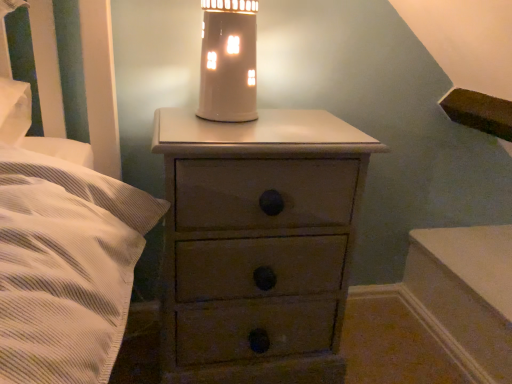
Question: Is matte brown chest of drawers at center placed right next to matte white oil lamp at upper center?

Choices:
 (A) yes
 (B) no

Answer: (B)

Question: From the image's perspective, does matte brown chest of drawers at center appear lower than matte white oil lamp at upper center?

Choices:
 (A) yes
 (B) no

Answer: (A)

Question: From the image's perspective, is matte brown chest of drawers at center over matte white oil lamp at upper center?

Choices:
 (A) yes
 (B) no

Answer: (B)

Question: Does matte brown chest of drawers at center have a greater height compared to matte white oil lamp at upper center?

Choices:
 (A) no
 (B) yes

Answer: (B)

Question: Is matte brown chest of drawers at center far from matte white oil lamp at upper center?

Choices:
 (A) no
 (B) yes

Answer: (A)

Question: Is the depth of matte brown chest of drawers at center less than that of matte white oil lamp at upper center?

Choices:
 (A) no
 (B) yes

Answer: (B)

Question: Can you confirm if matte white oil lamp at upper center is smaller than matte brown chest of drawers at center?

Choices:
 (A) no
 (B) yes

Answer: (B)

Question: Can you confirm if matte white oil lamp at upper center is positioned to the left of matte brown chest of drawers at center?

Choices:
 (A) yes
 (B) no

Answer: (A)

Question: Is the position of matte white oil lamp at upper center less distant than that of matte brown chest of drawers at center?

Choices:
 (A) yes
 (B) no

Answer: (B)

Question: Can you confirm if matte white oil lamp at upper center is shorter than matte brown chest of drawers at center?

Choices:
 (A) yes
 (B) no

Answer: (A)

Question: From the image's perspective, is matte white oil lamp at upper center under matte brown chest of drawers at center?

Choices:
 (A) no
 (B) yes

Answer: (A)

Question: Would you say matte white oil lamp at upper center is outside matte brown chest of drawers at center?

Choices:
 (A) no
 (B) yes

Answer: (B)

Question: Is matte white oil lamp at upper center situated inside matte brown chest of drawers at center or outside?

Choices:
 (A) inside
 (B) outside

Answer: (B)